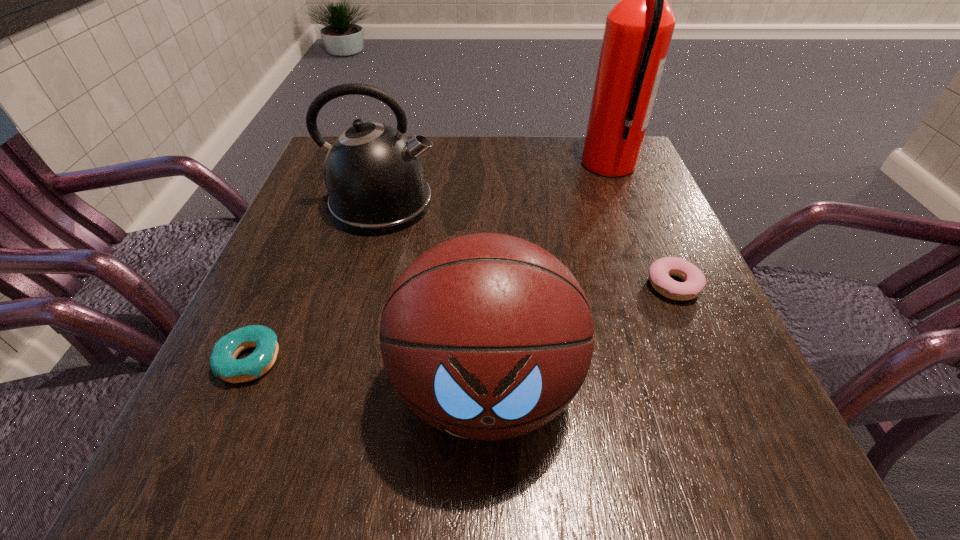
Where is `fire extinguisher`? fire extinguisher is located at coordinates (638, 31).

Where is `kettle`? This screenshot has width=960, height=540. kettle is located at coordinates (375, 177).

This screenshot has width=960, height=540. In order to click on basketball in this screenshot , I will do `click(486, 336)`.

Identify the location of the right doughnut. The height and width of the screenshot is (540, 960). (660, 271).

The image size is (960, 540). In order to click on the third nearest object in this screenshot , I will do `click(660, 271)`.

You are a GUI agent. You are given a task and a screenshot of the screen. Output one action in this format:
    pyautogui.click(x=<x>, y=<y>)
    Task: Click on the left doughnut
    
    Given the screenshot: What is the action you would take?
    pyautogui.click(x=223, y=362)

Where is `free space located 0.130m at the nozzle of the tallest object`? This screenshot has width=960, height=540. free space located 0.130m at the nozzle of the tallest object is located at coordinates [x=527, y=165].

Find the location of `free region located at the nozzle of the tallest object`. free region located at the nozzle of the tallest object is located at coordinates (497, 165).

You are a GUI agent. You are given a task and a screenshot of the screen. Output one action in this format:
    pyautogui.click(x=<x>, y=<y>)
    Task: Click on the free region located at the nozzle of the tallest object
    
    Given the screenshot: What is the action you would take?
    pyautogui.click(x=451, y=165)

You are a GUI agent. You are given a task and a screenshot of the screen. Output one action in this format:
    pyautogui.click(x=<x>, y=<y>)
    Task: Click on the free spot located on the spout of the kettle
    This screenshot has width=960, height=540.
    Given the screenshot: What is the action you would take?
    pyautogui.click(x=485, y=205)